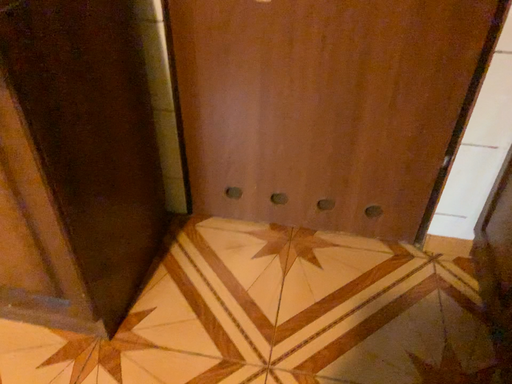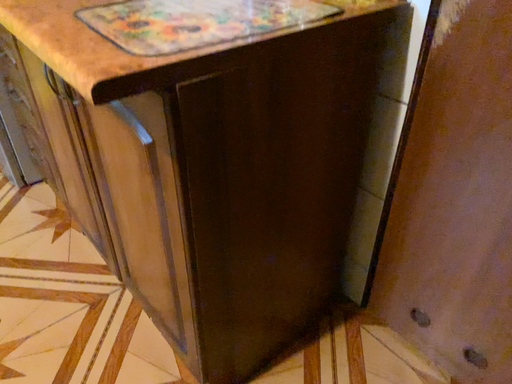
Question: Which way did the camera rotate in the video?

Choices:
 (A) rotated left
 (B) rotated right

Answer: (A)